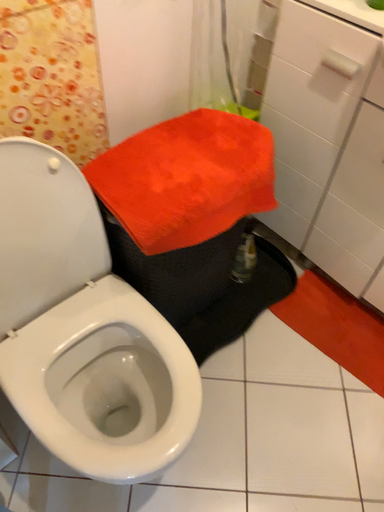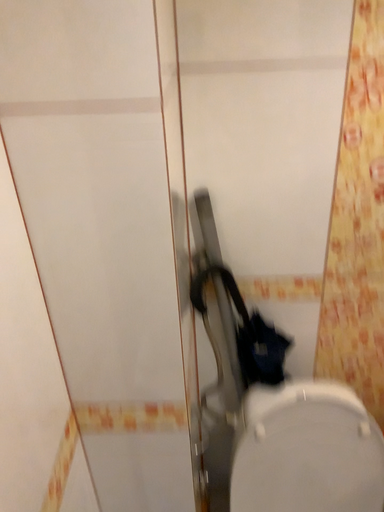
Question: Which way did the camera rotate in the video?

Choices:
 (A) rotated right
 (B) rotated left

Answer: (B)